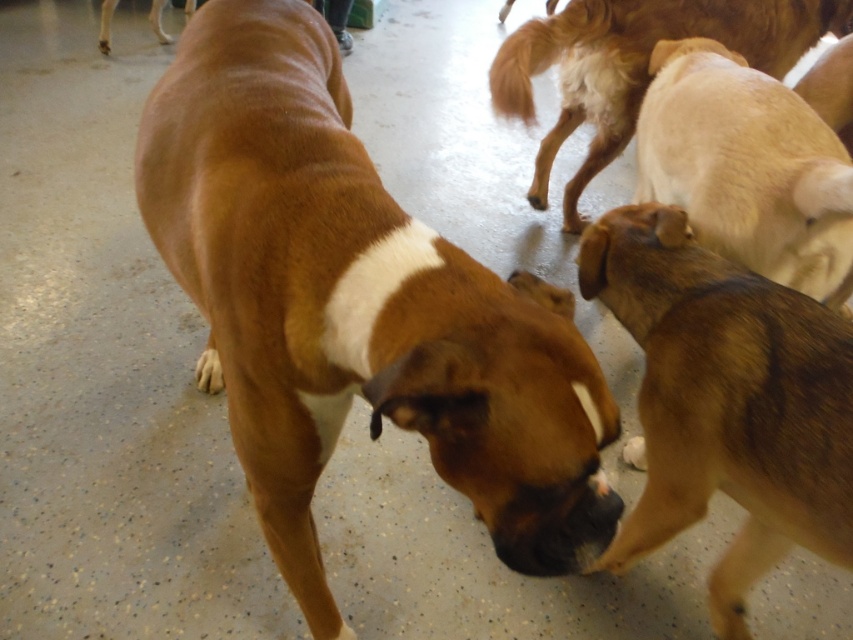
Question: Is light brown fur at right closer to camera compared to light brown fur at center?

Choices:
 (A) yes
 (B) no

Answer: (A)

Question: Estimate the real-world distances between objects in this image. Which object is closer to the light brown fur at center?

Choices:
 (A) light brown fur at right
 (B) brown smooth dog at center

Answer: (A)

Question: Does brown smooth dog at center appear over light brown fur paw at lower left?

Choices:
 (A) no
 (B) yes

Answer: (B)

Question: Can you confirm if brown smooth dog at center is positioned above light brown fur paw at lower left?

Choices:
 (A) yes
 (B) no

Answer: (A)

Question: Among these objects, which one is nearest to the camera?

Choices:
 (A) brown smooth dog at center
 (B) brown fur dog at upper left

Answer: (A)

Question: Which of the following is the farthest from the observer?

Choices:
 (A) brown smooth dog at center
 (B) light brown fur at center
 (C) light brown fur paw at lower left
 (D) brown furry dog at center

Answer: (B)